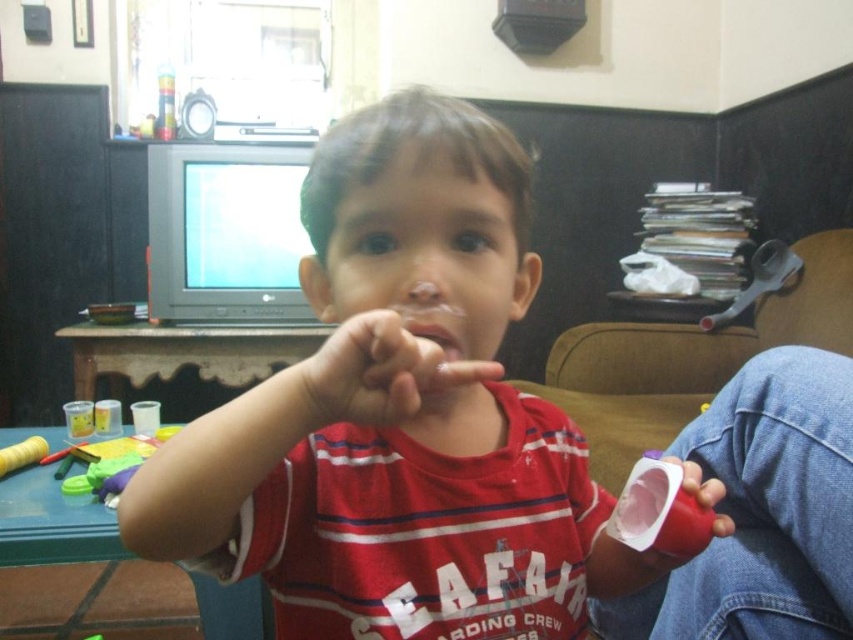
Question: Is red matte shirt at center above pink matte cup at lower right?

Choices:
 (A) yes
 (B) no

Answer: (A)

Question: Based on their relative distances, which object is farther from the red matte shirt at center?

Choices:
 (A) pink matte cup at lower right
 (B) clear plastic mouth at center

Answer: (A)

Question: Based on their relative distances, which object is nearer to the clear plastic mouth at center?

Choices:
 (A) red matte shirt at center
 (B) pink matte cup at lower right

Answer: (A)

Question: Which point is closer to the camera taking this photo?

Choices:
 (A) (426, 337)
 (B) (440, 204)

Answer: (A)

Question: Is pink matte cup at lower right positioned behind clear plastic mouth at center?

Choices:
 (A) yes
 (B) no

Answer: (A)

Question: Observing the image, what is the correct spatial positioning of pink matte cup at lower right in reference to clear plastic mouth at center?

Choices:
 (A) left
 (B) right

Answer: (B)